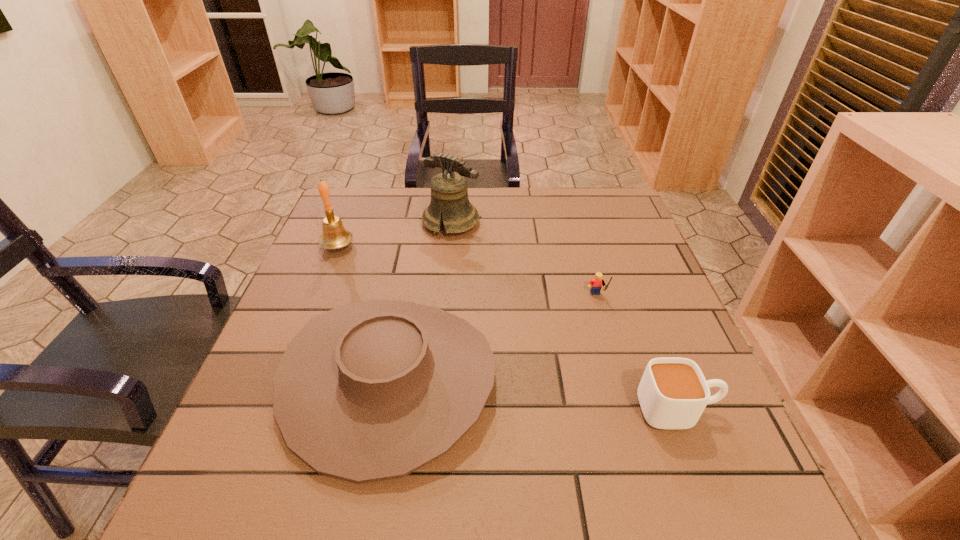
At what (x,y) coordinates should I click in order to perform the action: click on vacant area that lies between the right bell and the cowboy hat. Please return your answer as a coordinate pair (x, y). The height and width of the screenshot is (540, 960). Looking at the image, I should click on (420, 301).

Locate an element on the screen. This screenshot has width=960, height=540. free space that is in between the left bell and the third farthest object is located at coordinates (468, 272).

This screenshot has height=540, width=960. I want to click on object that is the third closest to the cowboy hat, so click(x=449, y=194).

Locate an element on the screen. This screenshot has width=960, height=540. object that is the fourth closest to the cowboy hat is located at coordinates (673, 392).